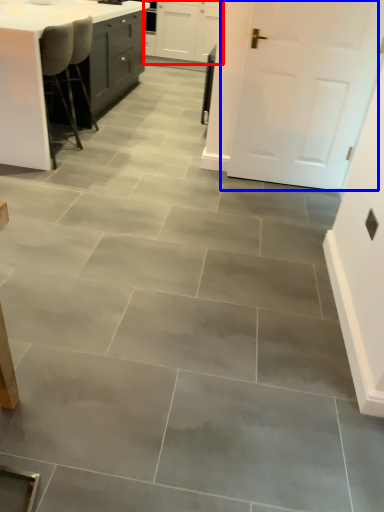
Question: Which object appears closest to the camera in this image, cabinetry (highlighted by a red box) or door (highlighted by a blue box)?

Choices:
 (A) cabinetry
 (B) door

Answer: (B)